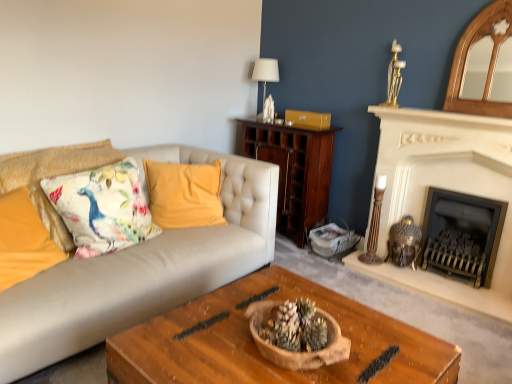
Question: Is velvet yellow pillow at center, the 3th pillow when ordered from left to right, far away from floral fabric cushion at left, which ranks as the 1th pillow in left-to-right order?

Choices:
 (A) yes
 (B) no

Answer: (B)

Question: Does velvet yellow pillow at center, the 3th pillow when ordered from left to right, have a lesser width compared to floral fabric cushion at left, which ranks as the 1th pillow in left-to-right order?

Choices:
 (A) no
 (B) yes

Answer: (B)

Question: Is velvet yellow pillow at center, the 3th pillow when ordered from left to right, looking in the opposite direction of floral fabric cushion at left, which ranks as the 1th pillow in left-to-right order?

Choices:
 (A) yes
 (B) no

Answer: (B)

Question: From a real-world perspective, is velvet yellow pillow at center, the 3th pillow when ordered from left to right, below floral fabric cushion at left, the third pillow from the right?

Choices:
 (A) yes
 (B) no

Answer: (B)

Question: Could you tell me if velvet yellow pillow at center, the 3th pillow when ordered from left to right, is facing floral fabric cushion at left, the third pillow from the right?

Choices:
 (A) yes
 (B) no

Answer: (B)

Question: From the image's perspective, is gold metallic candle holder at upper right, acting as the second candle holder starting from the bottom, above or below wooden candle holder at right, the second candle holder positioned from the top?

Choices:
 (A) above
 (B) below

Answer: (A)

Question: Is point (396, 46) positioned closer to the camera than point (373, 205)?

Choices:
 (A) closer
 (B) farther

Answer: (A)

Question: Considering the positions of gold metallic candle holder at upper right, acting as the second candle holder starting from the bottom, and wooden candle holder at right, placed as the first candle holder when sorted from bottom to top, in the image, is gold metallic candle holder at upper right, acting as the second candle holder starting from the bottom, wider or thinner than wooden candle holder at right, placed as the first candle holder when sorted from bottom to top,?

Choices:
 (A) thin
 (B) wide

Answer: (A)

Question: From a real-world perspective, relative to wooden candle holder at right, the second candle holder positioned from the top, is gold metallic candle holder at upper right, acting as the second candle holder starting from the bottom, vertically above or below?

Choices:
 (A) above
 (B) below

Answer: (A)

Question: Is black metal fireplace at right, which is counted as the 2th fireplace, starting from the left, taller or shorter than velvet yellow pillow at center, the 3th pillow when ordered from left to right?

Choices:
 (A) short
 (B) tall

Answer: (A)

Question: Is point (451, 271) positioned closer to the camera than point (152, 192)?

Choices:
 (A) farther
 (B) closer

Answer: (A)

Question: In terms of width, does black metal fireplace at right, the 1th fireplace viewed from the right, look wider or thinner when compared to velvet yellow pillow at center, the 3th pillow when ordered from left to right?

Choices:
 (A) thin
 (B) wide

Answer: (A)

Question: Is black metal fireplace at right, the 1th fireplace viewed from the right, bigger or smaller than velvet yellow pillow at center, the 3th pillow when ordered from left to right?

Choices:
 (A) big
 (B) small

Answer: (B)

Question: Does point (117, 380) appear closer or farther from the camera than point (485, 253)?

Choices:
 (A) closer
 (B) farther

Answer: (A)

Question: Would you say wooden bowl at center is to the left or to the right of black metal fireplace at right, which is counted as the 2th fireplace, starting from the left, in the picture?

Choices:
 (A) right
 (B) left

Answer: (B)